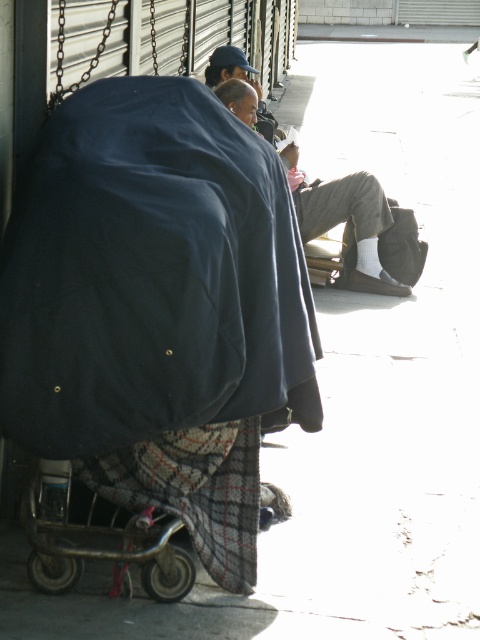
Which of these two, plaid fabric blanket at lower center or metallic silver cart at lower left, stands shorter?

metallic silver cart at lower left is shorter.

Is plaid fabric blanket at lower center shorter than metallic silver cart at lower left?

No, plaid fabric blanket at lower center is not shorter than metallic silver cart at lower left.

This screenshot has height=640, width=480. Describe the element at coordinates (193, 490) in the screenshot. I see `plaid fabric blanket at lower center` at that location.

Where is `plaid fabric blanket at lower center`? plaid fabric blanket at lower center is located at coordinates 193,490.

How much distance is there between dark blue fabric at center and light brown leather jacket at center?

dark blue fabric at center and light brown leather jacket at center are 4.35 meters apart from each other.

Who is positioned more to the right, dark blue fabric at center or light brown leather jacket at center?

light brown leather jacket at center is more to the right.

Who is more forward, [216,173] or [291,148]?

Point [216,173] is in front.

Find the location of `dark blue fabric at center`. dark blue fabric at center is located at coordinates (151, 275).

Between plaid fabric blanket at lower center and light brown leather jacket at center, which one appears on the left side from the viewer's perspective?

From the viewer's perspective, plaid fabric blanket at lower center appears more on the left side.

Between plaid fabric blanket at lower center and light brown leather jacket at center, which one is positioned higher?

light brown leather jacket at center

Who is more distant from viewer, (122, 493) or (247, 106)?

The point (247, 106) is behind.

Locate an element on the screen. This screenshot has height=640, width=480. plaid fabric blanket at lower center is located at coordinates pyautogui.click(x=193, y=490).